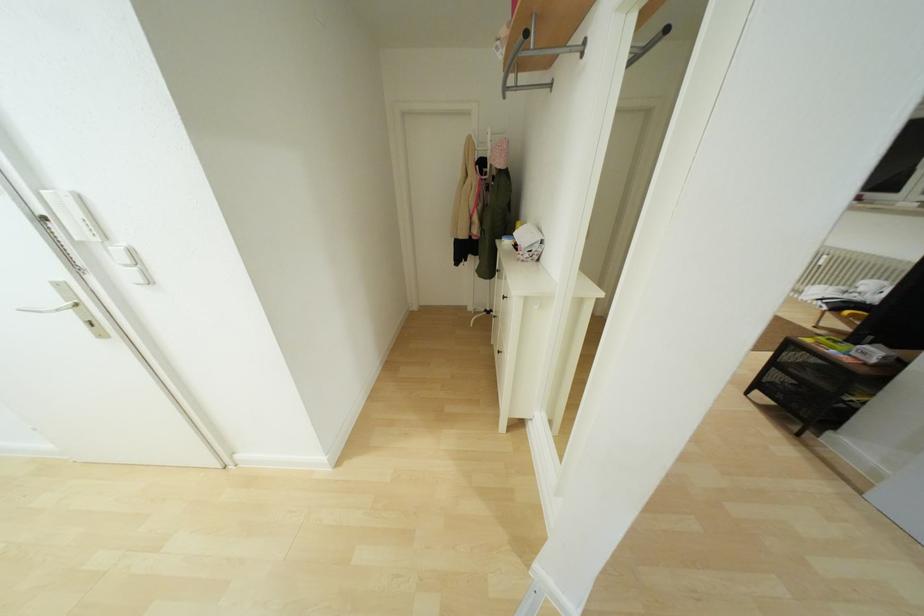
Where is `white door handle`? white door handle is located at coordinates pyautogui.click(x=50, y=309).